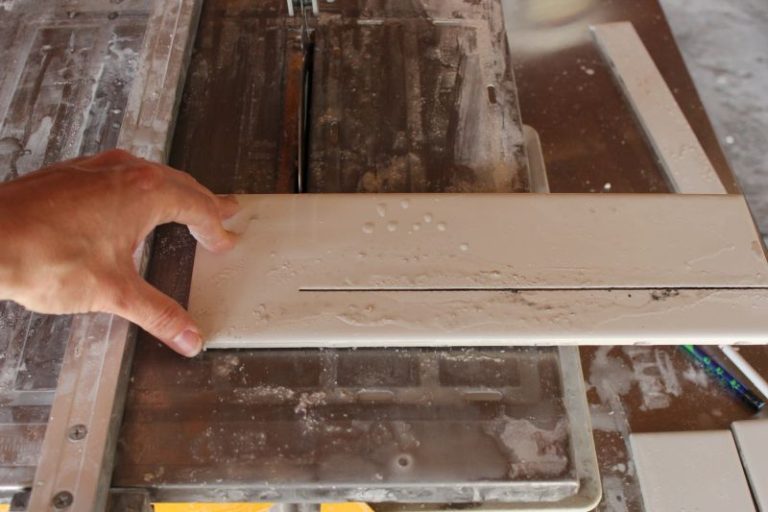
Identify the location of brown table surface. The height and width of the screenshot is (512, 768). (607, 110).